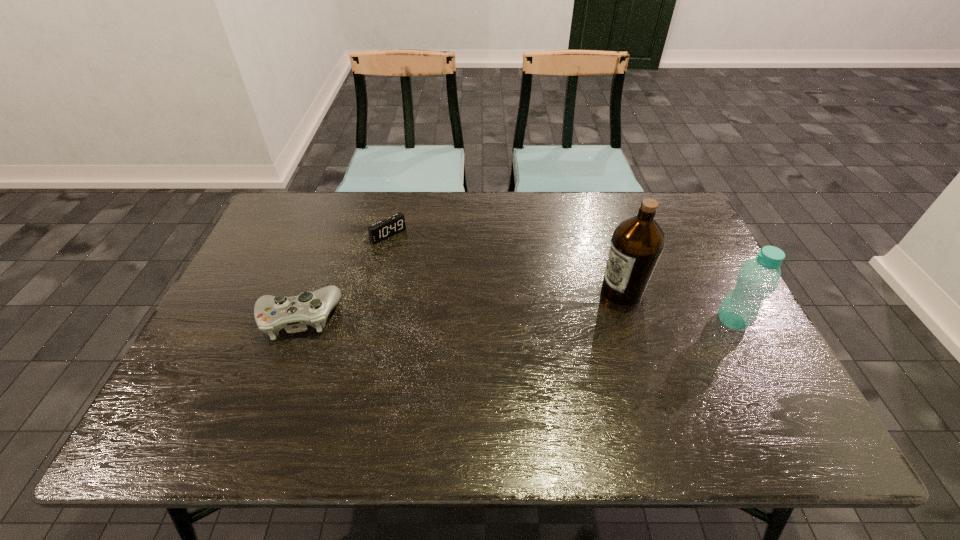
This screenshot has width=960, height=540. Identify the location of free point at the near edge. (621, 372).

Where is `vacant space at the right edge`? vacant space at the right edge is located at coordinates point(664,265).

In order to click on vacant point at the far left corner in this screenshot , I will do `click(293, 223)`.

Where is `vacant space at the near left corner of the desktop`? The width and height of the screenshot is (960, 540). vacant space at the near left corner of the desktop is located at coordinates (248, 369).

Find the location of `free space at the far right corner`. free space at the far right corner is located at coordinates (694, 228).

The image size is (960, 540). I want to click on free space at the near right corner, so click(735, 400).

At what (x,y) coordinates should I click in order to perform the action: click on empty space that is in between the third shortest object and the third object from right to left. Please return your answer as a coordinate pair (x, y). This screenshot has width=960, height=540. Looking at the image, I should click on (560, 278).

What are the coordinates of `free space that is in between the second tallest object and the second shortest object` in the screenshot? It's located at (516, 319).

Where is `free space between the third tallest object and the second object from left to right`? The width and height of the screenshot is (960, 540). free space between the third tallest object and the second object from left to right is located at coordinates (343, 276).

Find the location of `vacant space in between the shortest object and the third tallest object`. vacant space in between the shortest object and the third tallest object is located at coordinates (343, 276).